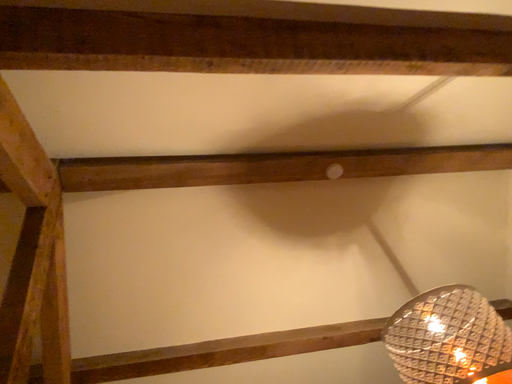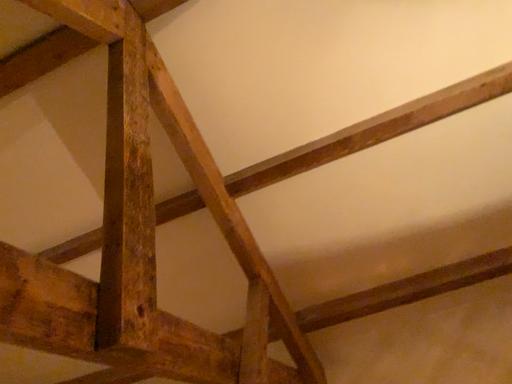
Question: Which way did the camera rotate in the video?

Choices:
 (A) rotated upward
 (B) rotated downward

Answer: (B)